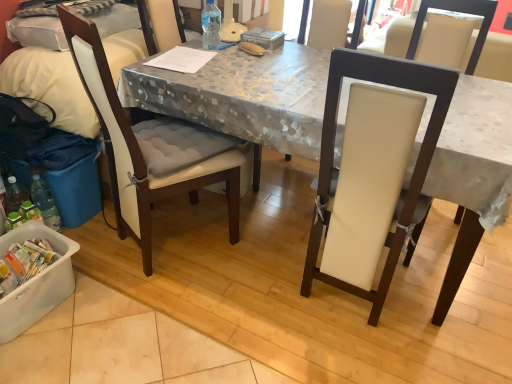
Question: From a real-world perspective, is white fabric-covered desk at center above or below transparent plastic bottle at table center?

Choices:
 (A) above
 (B) below

Answer: (B)

Question: Is point (465, 183) positioned closer to the camera than point (218, 36)?

Choices:
 (A) closer
 (B) farther

Answer: (A)

Question: Estimate the real-world distances between objects in this image. Which object is closer to the white padded chair at left, the first chair from the left?

Choices:
 (A) white fabric-covered desk at center
 (B) white leather chair at center, which appears as the second chair when viewed from the left
 (C) matte white chair at left
 (D) white plastic container at lower left
 (E) transparent plastic bottle at table center

Answer: (A)

Question: Which is farther from the white padded chair at left, the first chair from the left?

Choices:
 (A) white leather chair at center, acting as the first chair starting from the right
 (B) transparent plastic bottle at table center
 (C) white plastic container at lower left
 (D) matte white chair at left
 (E) white fabric-covered desk at center

Answer: (B)